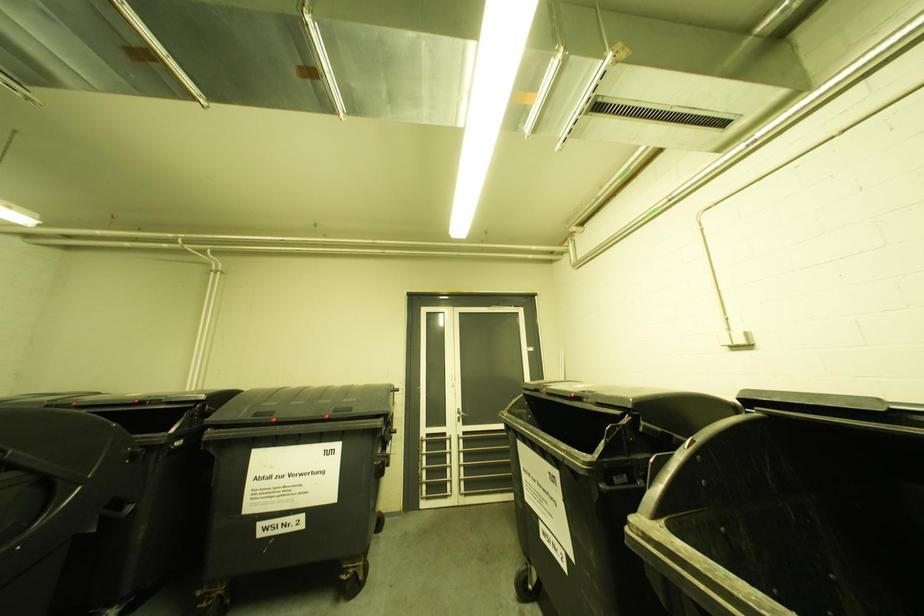
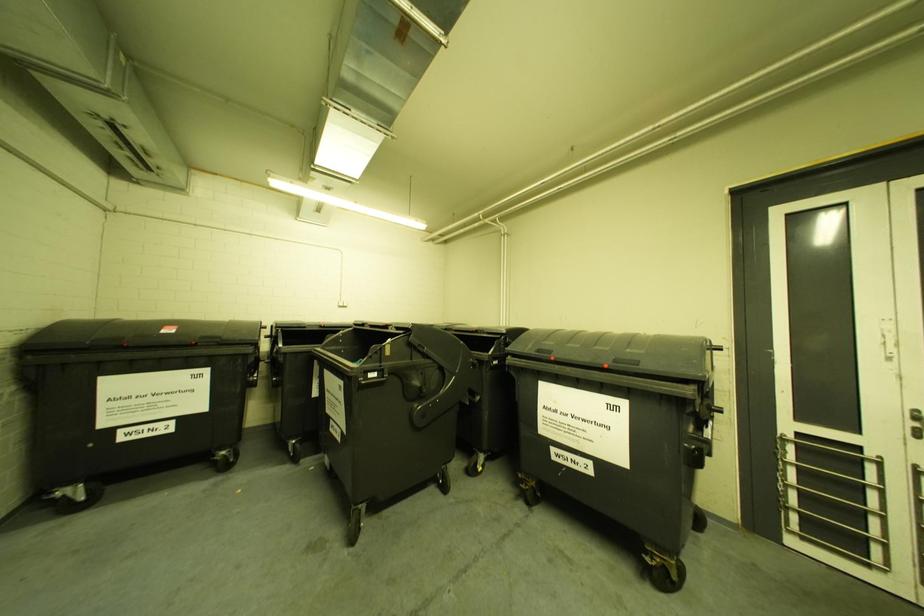
Question: Based on the continuous images, in which direction is the camera rotating? Reply with the corresponding letter.

Choices:
 (A) Left
 (B) Right
 (C) Up
 (D) Down

Answer: (A)